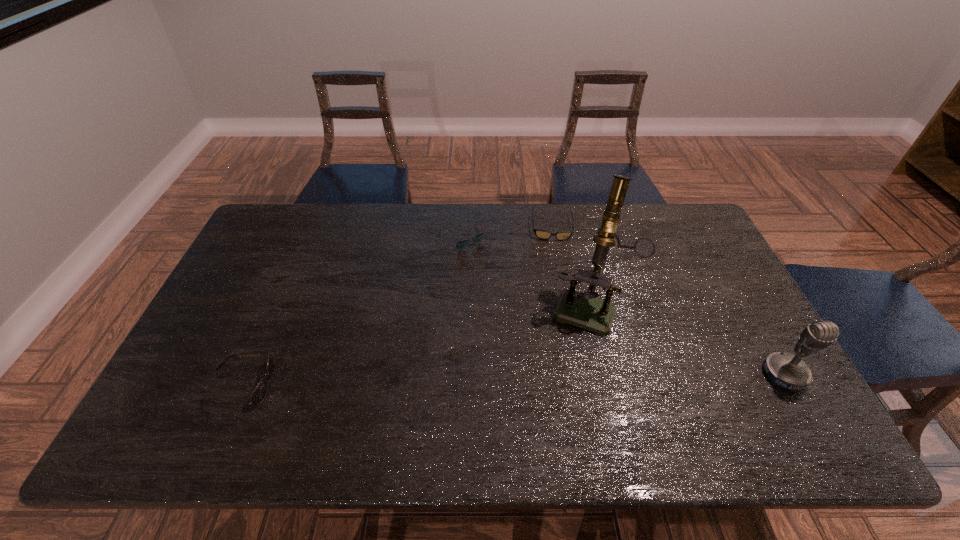
Locate an element on the screen. This screenshot has width=960, height=540. object at the left edge is located at coordinates 259,393.

Find the location of `object positioned at the right edge`. object positioned at the right edge is located at coordinates (785, 370).

Where is `object that is at the near left corner`? The image size is (960, 540). object that is at the near left corner is located at coordinates (259, 393).

This screenshot has width=960, height=540. I want to click on object positioned at the near right corner, so click(785, 370).

I want to click on free spot at the far edge of the desktop, so click(x=483, y=211).

Locate an element on the screen. vacant space at the near edge is located at coordinates (490, 384).

The height and width of the screenshot is (540, 960). In the image, there is a desktop. Identify the location of free space at the left edge. (234, 286).

In the image, there is a desktop. In order to click on vacant space at the far left corner in this screenshot , I will do `click(276, 221)`.

Locate an element on the screen. The height and width of the screenshot is (540, 960). vacant region at the far right corner is located at coordinates (698, 227).

Locate an element on the screen. The height and width of the screenshot is (540, 960). vacant space at the near right corner of the desktop is located at coordinates (763, 409).